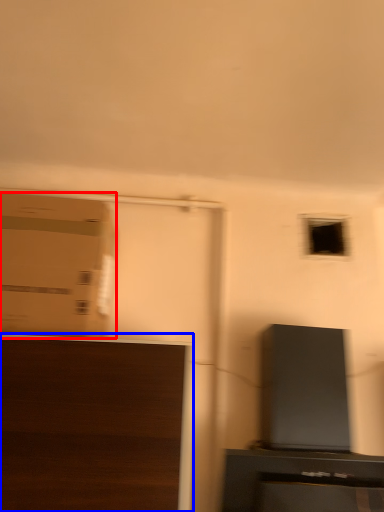
Question: Which of the following is the farthest to the observer, cardboard box (highlighted by a red box) or furniture (highlighted by a blue box)?

Choices:
 (A) cardboard box
 (B) furniture

Answer: (A)